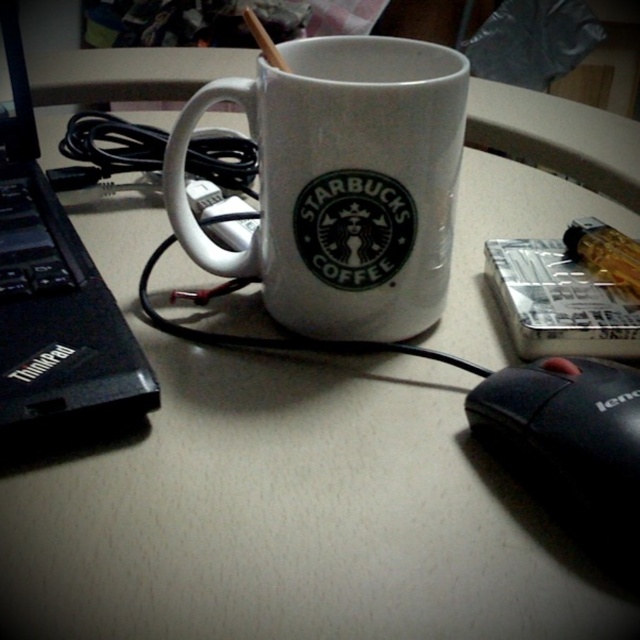
Question: Estimate the real-world distances between objects in this image. Which object is closer to the black plastic thinkpad at left?

Choices:
 (A) white ceramic mug at center
 (B) black matte mouse at lower right

Answer: (A)

Question: Is white ceramic mug at center to the left of black matte mouse at lower right from the viewer's perspective?

Choices:
 (A) no
 (B) yes

Answer: (B)

Question: Estimate the real-world distances between objects in this image. Which object is closer to the white ceramic mug at center?

Choices:
 (A) black matte mouse at lower right
 (B) black plastic thinkpad at left

Answer: (B)

Question: Where is white ceramic mug at center located in relation to black matte mouse at lower right in the image?

Choices:
 (A) below
 (B) above

Answer: (B)

Question: Does white ceramic mug at center have a greater width compared to black plastic thinkpad at left?

Choices:
 (A) no
 (B) yes

Answer: (A)

Question: Based on their relative distances, which object is nearer to the white ceramic mug at center?

Choices:
 (A) black matte mouse at lower right
 (B) black plastic thinkpad at left

Answer: (B)